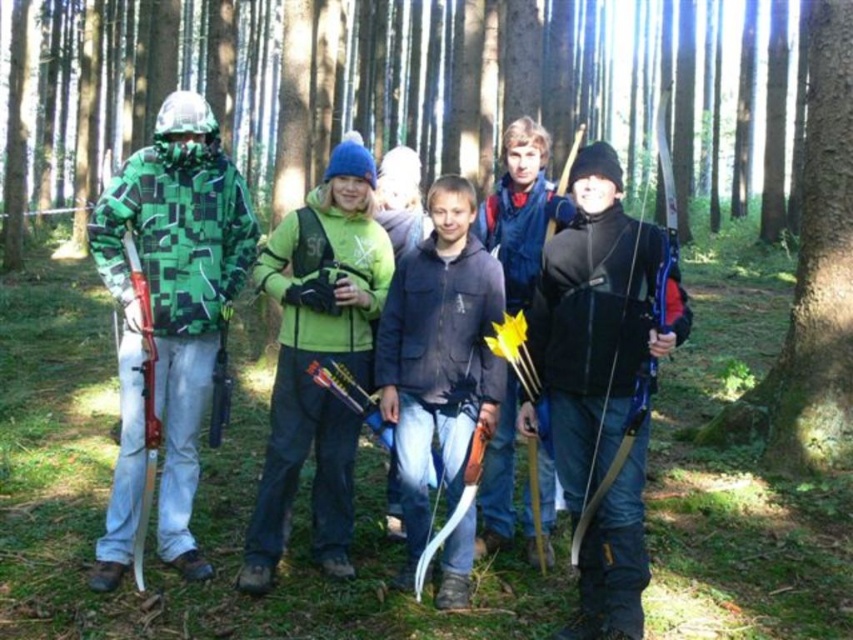
Question: Which point appears closest to the camera in this image?

Choices:
 (A) click(851, 204)
 (B) click(187, 125)
 (C) click(596, 378)

Answer: (C)

Question: Where is dark blue jacket at center located in relation to blue fabric jacket at center in the image?

Choices:
 (A) left
 (B) right

Answer: (A)

Question: Which point appears closest to the camera in this image?

Choices:
 (A) (480, 282)
 (B) (201, 404)
 (C) (598, 394)

Answer: (C)

Question: Among these objects, which one is nearest to the camera?

Choices:
 (A) green matte jacket at center
 (B) dark blue jacket at center

Answer: (B)

Question: Can you confirm if dark blue jacket at center is positioned to the left of blue fabric jacket at center?

Choices:
 (A) no
 (B) yes

Answer: (B)

Question: In this image, where is dark blue jacket at center located relative to blue fabric jacket at center?

Choices:
 (A) left
 (B) right

Answer: (A)